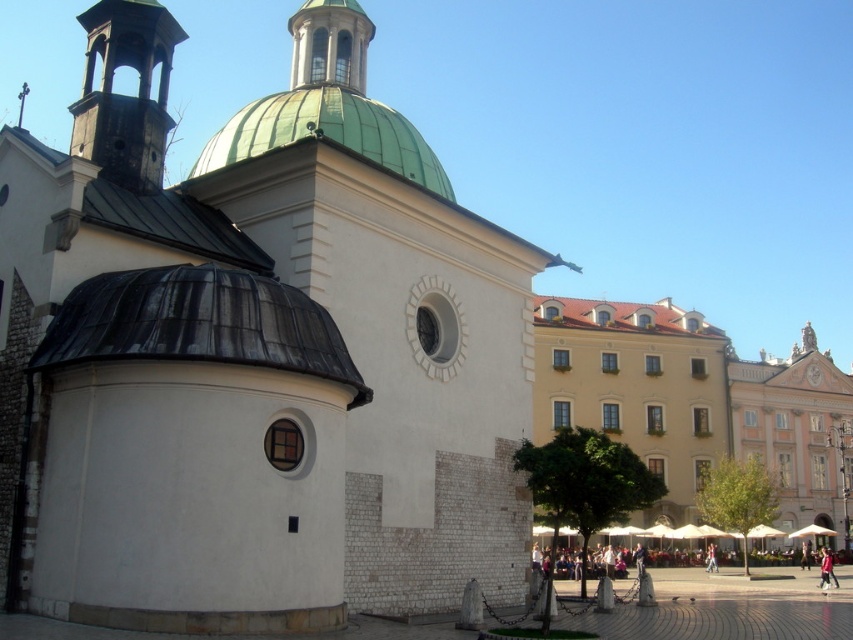
Question: Which point is farther to the camera?

Choices:
 (A) (364, 132)
 (B) (280, 538)

Answer: (A)

Question: Estimate the real-world distances between objects in this image. Which object is closer to the green copper dome at center?

Choices:
 (A) green dome at upper center
 (B) white stone church at center
 (C) rusty metal bell tower at upper left

Answer: (A)

Question: Is green copper dome at center wider than rusty metal bell tower at upper left?

Choices:
 (A) no
 (B) yes

Answer: (B)

Question: Which is nearer to the white stone church at center?

Choices:
 (A) green dome at upper center
 (B) green copper dome at center
 (C) rusty metal bell tower at upper left

Answer: (B)

Question: Is white stone church at center wider than rusty metal bell tower at upper left?

Choices:
 (A) no
 (B) yes

Answer: (B)

Question: Is rusty metal bell tower at upper left smaller than green dome at upper center?

Choices:
 (A) no
 (B) yes

Answer: (A)